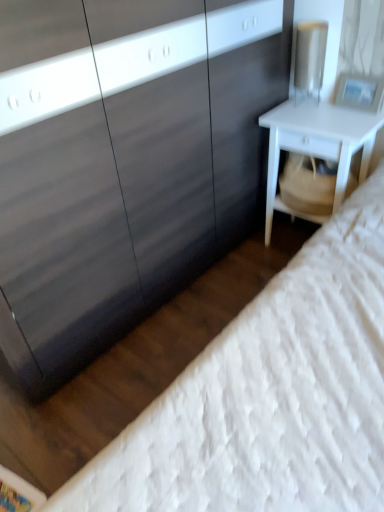
Where is `white matte nightstand at right`? The width and height of the screenshot is (384, 512). white matte nightstand at right is located at coordinates (317, 145).

Can white matte nightstand at right be found inside white textured mattress at lower right?

Yes, white matte nightstand at right is inside white textured mattress at lower right.

From the picture: Is white textured mattress at lower right looking in the opposite direction of white matte nightstand at right?

white textured mattress at lower right does not have its back to white matte nightstand at right.

Is point (302, 437) behind point (271, 218)?

No, it is not.

Considering the relative sizes of white textured mattress at lower right and white matte nightstand at right in the image provided, is white textured mattress at lower right shorter than white matte nightstand at right?

Incorrect, the height of white textured mattress at lower right does not fall short of that of white matte nightstand at right.

Does white matte nightstand at right have a lesser width compared to white textured mattress at lower right?

Correct, the width of white matte nightstand at right is less than that of white textured mattress at lower right.

Locate an element on the screen. The image size is (384, 512). nightstand lying above the white textured mattress at lower right (from the image's perspective) is located at coordinates (317, 145).

Can you tell me how much white matte nightstand at right and white textured mattress at lower right differ in facing direction?

They differ by 2.49 degrees in their facing directions.

Is white matte nightstand at right facing towards white textured mattress at lower right?

Yes.

Considering their positions, is white textured mattress at lower right located in front of or behind matte black dresser at center?

Visually, white textured mattress at lower right is located in front of matte black dresser at center.

Locate an element on the screen. The image size is (384, 512). dresser above the white textured mattress at lower right (from a real-world perspective) is located at coordinates (124, 161).

Is white textured mattress at lower right to the right of matte black dresser at center from the viewer's perspective?

Correct, you'll find white textured mattress at lower right to the right of matte black dresser at center.

From the image's perspective, is matte black dresser at center below white textured mattress at lower right?

Incorrect, from the image's perspective, matte black dresser at center is higher than white textured mattress at lower right.

In the image, is matte black dresser at center on the left side or the right side of white textured mattress at lower right?

From the image, it's evident that matte black dresser at center is to the left of white textured mattress at lower right.

Find the location of `dresser above the white textured mattress at lower right (from a real-world perspective)`. dresser above the white textured mattress at lower right (from a real-world perspective) is located at coordinates (124, 161).

From the image's perspective, which is above, white matte nightstand at right or matte black dresser at center?

matte black dresser at center.

Does white matte nightstand at right turn towards matte black dresser at center?

No.

Find the location of a particular element. dresser located above the white matte nightstand at right (from the image's perspective) is located at coordinates (124, 161).

Does white matte nightstand at right lie behind matte black dresser at center?

Yes, it is.

Is point (194, 181) positioned before point (321, 118)?

No, (194, 181) is behind (321, 118).

Considering the sizes of objects matte black dresser at center and white matte nightstand at right in the image provided, who is shorter, matte black dresser at center or white matte nightstand at right?

With less height is white matte nightstand at right.

Which object is thinner, matte black dresser at center or white matte nightstand at right?

white matte nightstand at right is thinner.

Would you consider matte black dresser at center to be distant from white matte nightstand at right?

No, there isn't a large distance between matte black dresser at center and white matte nightstand at right.

You are a GUI agent. You are given a task and a screenshot of the screen. Output one action in this format:
    pyautogui.click(x=<x>, y=<y>)
    Task: Click on the bed below the white matte nightstand at right (from the image's perspective)
    The height and width of the screenshot is (512, 384).
    Given the screenshot: What is the action you would take?
    pyautogui.click(x=270, y=395)

The height and width of the screenshot is (512, 384). In the image, there is a white textured mattress at lower right. In order to click on nightstand below it (from a real-world perspective) in this screenshot , I will do `click(317, 145)`.

Estimate the real-world distances between objects in this image. Which object is further from white matte nightstand at right, matte black dresser at center or white textured mattress at lower right?

The object further to white matte nightstand at right is white textured mattress at lower right.

Which object lies further to the anchor point matte black dresser at center, white matte nightstand at right or white textured mattress at lower right?

white textured mattress at lower right.

Looking at the image, which one is located further to white textured mattress at lower right, matte black dresser at center or white matte nightstand at right?

white matte nightstand at right is positioned further to the anchor white textured mattress at lower right.

Based on their spatial positions, is white textured mattress at lower right or white matte nightstand at right closer to matte black dresser at center?

Based on the image, white matte nightstand at right appears to be nearer to matte black dresser at center.

When comparing their distances from white textured mattress at lower right, does white matte nightstand at right or matte black dresser at center seem further?

white matte nightstand at right is positioned further to the anchor white textured mattress at lower right.

In the scene shown: Considering their positions, is white textured mattress at lower right positioned further to white matte nightstand at right than matte black dresser at center?

white textured mattress at lower right is further to white matte nightstand at right.

Find the location of a particular element. This screenshot has height=512, width=384. dresser positioned between white textured mattress at lower right and white matte nightstand at right from near to far is located at coordinates (124, 161).